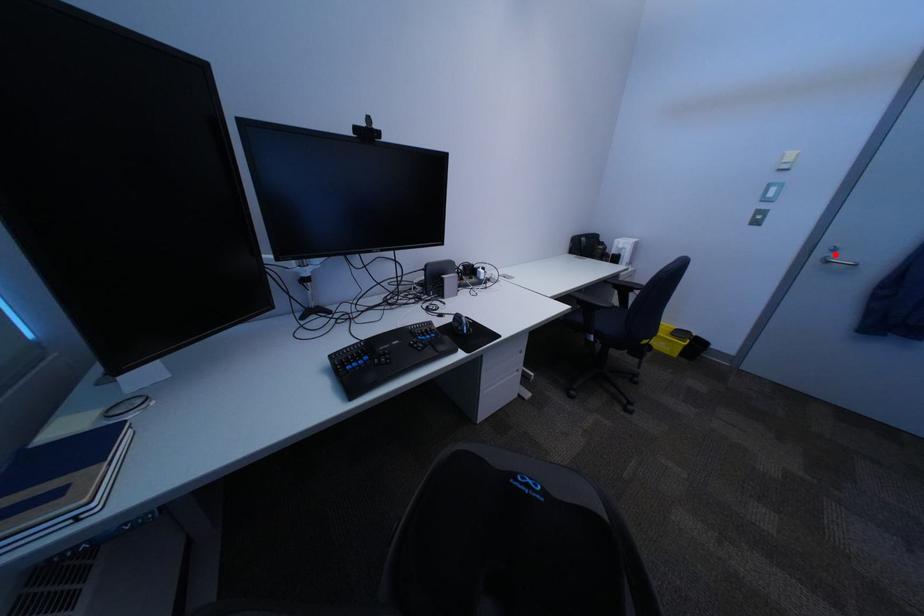
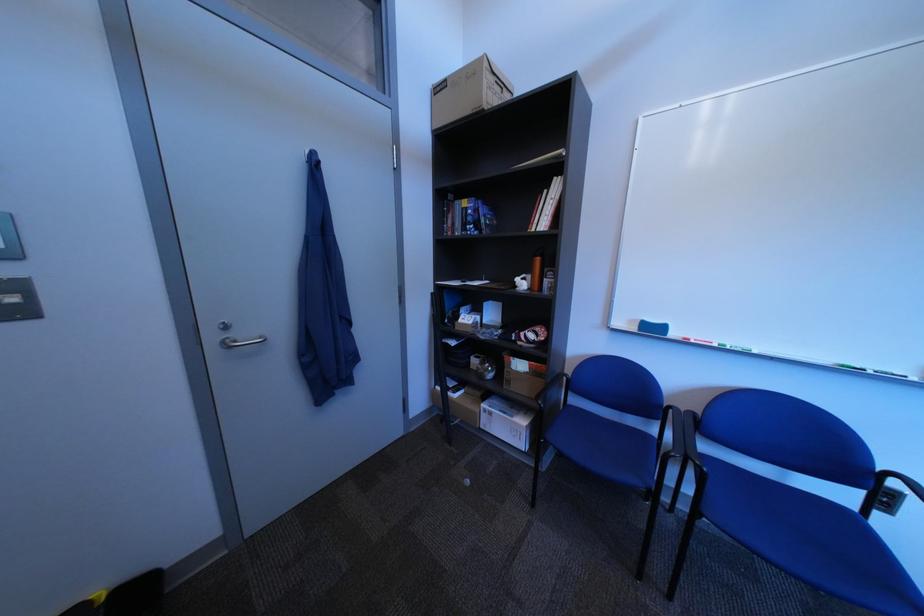
The point at the highlighted location is marked in the first image. Where is the corresponding point in the second image?

(226, 339)